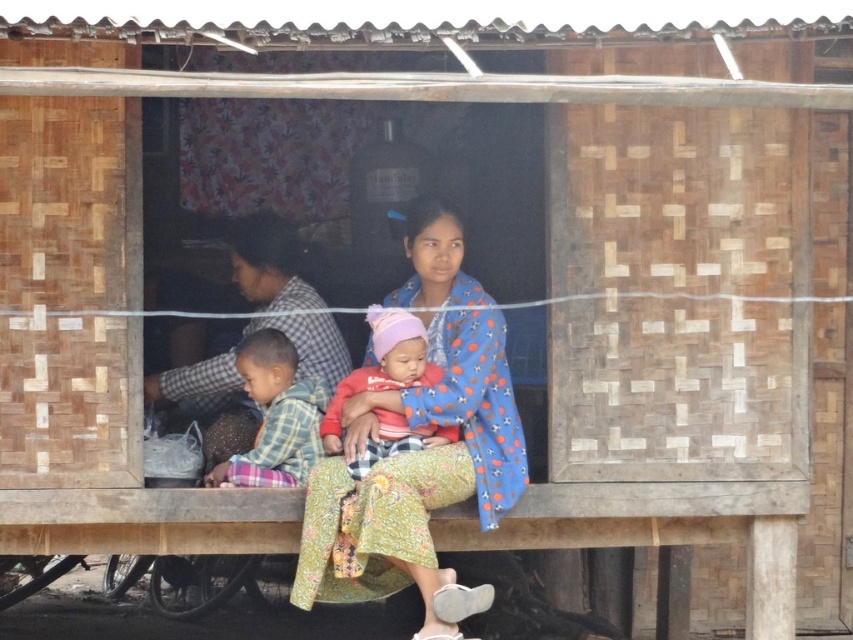
Question: Based on their relative distances, which object is farther from the plaid fabric shirt at lower left?

Choices:
 (A) red cotton baby at center
 (B) floral fabric dress at center

Answer: (B)

Question: Does floral fabric dress at center have a greater width compared to red cotton baby at center?

Choices:
 (A) yes
 (B) no

Answer: (A)

Question: Among these points, which one is nearest to the camera?

Choices:
 (A) click(x=439, y=584)
 (B) click(x=258, y=470)

Answer: (A)

Question: In this image, where is floral fabric dress at center located relative to plaid fabric shirt at lower left?

Choices:
 (A) below
 (B) above

Answer: (B)

Question: Can you confirm if floral fabric dress at center is positioned to the left of red cotton baby at center?

Choices:
 (A) yes
 (B) no

Answer: (B)

Question: Among these points, which one is nearest to the camera?

Choices:
 (A) (447, 380)
 (B) (399, 356)
 (C) (258, 460)

Answer: (B)